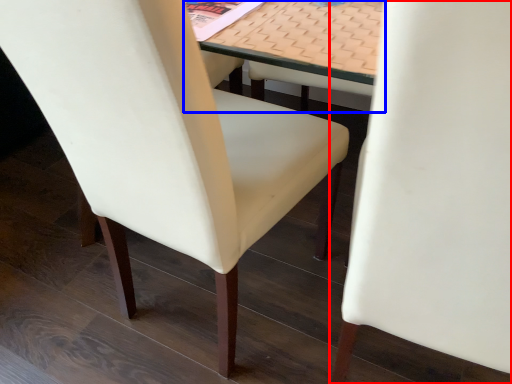
Question: Which point is closer to the camera, chair (highlighted by a red box) or table (highlighted by a blue box)?

Choices:
 (A) chair
 (B) table

Answer: (A)